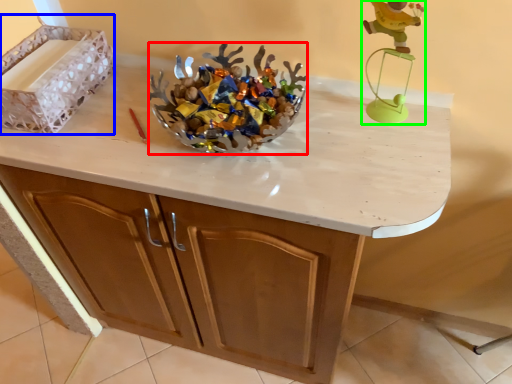
Question: Estimate the real-world distances between objects in this image. Which object is farther from stuff (highlighted by a red box), crate (highlighted by a blue box) or toy (highlighted by a green box)?

Choices:
 (A) crate
 (B) toy

Answer: (A)